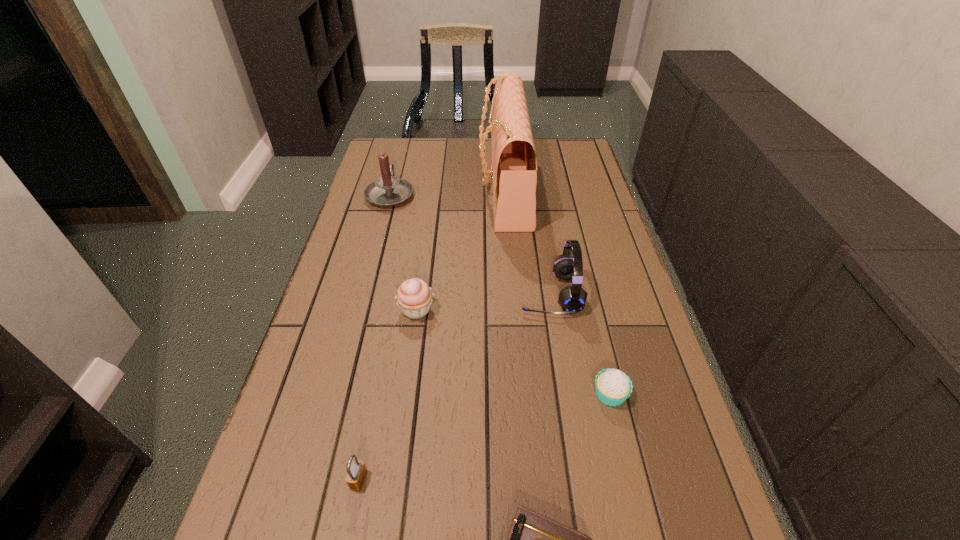
Locate an element on the screen. Image resolution: width=960 pixels, height=540 pixels. vacant space that's between the padlock and the third nearest object is located at coordinates (484, 437).

Find the location of a particular element. This screenshot has height=540, width=960. empty space that is in between the sixth farthest object and the left cupcake is located at coordinates (388, 395).

This screenshot has height=540, width=960. In order to click on free point between the handbag and the padlock in this screenshot , I will do `click(431, 334)`.

Locate an element on the screen. The width and height of the screenshot is (960, 540). vacant space that is in between the fourth tallest object and the tallest object is located at coordinates (460, 249).

Where is `free space between the headset and the candle`? This screenshot has width=960, height=540. free space between the headset and the candle is located at coordinates click(470, 244).

The image size is (960, 540). I want to click on the second closest object to the tallest object, so click(x=388, y=191).

Identify which object is located as the nearest to the right cupcake. Please provide its 2D coordinates. Your answer should be formatted as a tuple, i.e. [(x, y)], where the tuple contains the x and y coordinates of a point satisfying the conditions above.

[(572, 299)]

Where is `vacant region that satisfies the following two spatial constraints: 1. on the ear cushions of the shorter cupcake; 2. on the right side of the headset`? The width and height of the screenshot is (960, 540). vacant region that satisfies the following two spatial constraints: 1. on the ear cushions of the shorter cupcake; 2. on the right side of the headset is located at coordinates (565, 394).